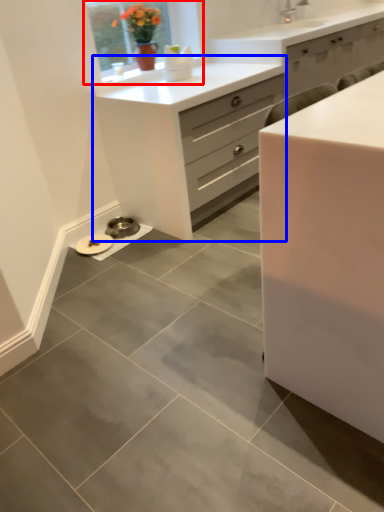
Question: Which of the following is the farthest to the observer, window (highlighted by a red box) or chest of drawers (highlighted by a blue box)?

Choices:
 (A) window
 (B) chest of drawers

Answer: (A)